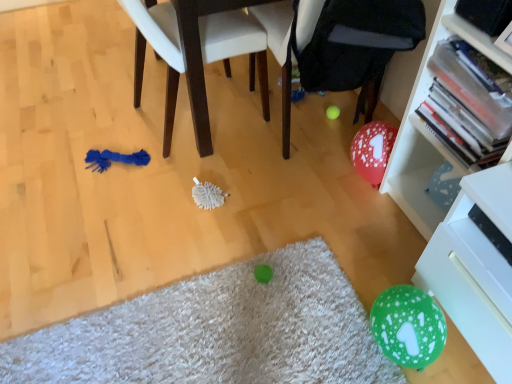
Where is `white glossy drawer at lower right`? This screenshot has height=384, width=512. white glossy drawer at lower right is located at coordinates (476, 267).

This screenshot has width=512, height=384. Find the location of `white plastic bookcase at right`. white plastic bookcase at right is located at coordinates (426, 134).

The height and width of the screenshot is (384, 512). Describe the element at coordinates (338, 44) in the screenshot. I see `black fabric bean bag chair at center` at that location.

What are the coordinates of `blue fabric chair at left` in the screenshot? It's located at (197, 52).

The image size is (512, 384). In order to click on white bristle brush at center in this screenshot , I will do `click(207, 195)`.

From the image's perspective, is blue fabric chair at left above white glossy drawer at lower right?

Yes, from the image's perspective, blue fabric chair at left is over white glossy drawer at lower right.

From a real-world perspective, does blue fabric chair at left sit lower than white glossy drawer at lower right?

No, from a real-world perspective, blue fabric chair at left is not below white glossy drawer at lower right.

Which is more to the right, blue fabric chair at left or white glossy drawer at lower right?

Positioned to the right is white glossy drawer at lower right.

Which is closer, [404,175] or [296,329]?

Point [296,329]

From a real-world perspective, who is located higher, white plastic bookcase at right or green fuzzy mat at lower center?

In real-world perspective, white plastic bookcase at right is above.

Are white plastic bookcase at right and green fuzzy mat at lower center beside each other?

No, white plastic bookcase at right is not beside green fuzzy mat at lower center.

Between white plastic bookcase at right and green fuzzy mat at lower center, which one has larger width?

green fuzzy mat at lower center.

Is black fabric bean bag chair at center not close to white glossy drawer at lower right?

black fabric bean bag chair at center is near white glossy drawer at lower right, not far away.

Can you confirm if black fabric bean bag chair at center is thinner than white glossy drawer at lower right?

Incorrect, the width of black fabric bean bag chair at center is not less than that of white glossy drawer at lower right.

Where is `shelf located in front of the black fabric bean bag chair at center`? The width and height of the screenshot is (512, 384). shelf located in front of the black fabric bean bag chair at center is located at coordinates (476, 267).

From a real-world perspective, is black fabric bean bag chair at center physically below white glossy drawer at lower right?

Actually, black fabric bean bag chair at center is physically above white glossy drawer at lower right in the real world.

Is white glossy drawer at lower right located outside green fuzzy mat at lower center?

Yes, white glossy drawer at lower right is outside of green fuzzy mat at lower center.

Which of these two, white glossy drawer at lower right or green fuzzy mat at lower center, stands shorter?

With less height is green fuzzy mat at lower center.

Considering the relative sizes of white glossy drawer at lower right and green fuzzy mat at lower center in the image provided, is white glossy drawer at lower right bigger than green fuzzy mat at lower center?

Yes, white glossy drawer at lower right is bigger than green fuzzy mat at lower center.

How far apart are white glossy drawer at lower right and blue fabric chair at left?

They are 3.57 feet apart.

Consider the image. Is blue fabric chair at left at the back of white glossy drawer at lower right?

No, blue fabric chair at left is not at the back of white glossy drawer at lower right.

Does white glossy drawer at lower right have a greater width compared to blue fabric chair at left?

Incorrect, the width of white glossy drawer at lower right does not surpass that of blue fabric chair at left.

From the image's perspective, which one is positioned higher, white glossy drawer at lower right or blue fabric chair at left?

blue fabric chair at left.

In the scene shown: Is green fuzzy mat at lower center taller than blue fabric chair at left?

No, green fuzzy mat at lower center is not taller than blue fabric chair at left.

Is green fuzzy mat at lower center in front of blue fabric chair at left?

Yes, green fuzzy mat at lower center is closer to the viewer.

Is green fuzzy mat at lower center in contact with blue fabric chair at left?

No, green fuzzy mat at lower center is not beside blue fabric chair at left.

Is green fuzzy mat at lower center spatially inside blue fabric chair at left, or outside of it?

green fuzzy mat at lower center is not enclosed by blue fabric chair at left.

This screenshot has width=512, height=384. I want to click on bookcase located in front of the white bristle brush at center, so click(x=426, y=134).

Who is shorter, white bristle brush at center or white plastic bookcase at right?

Standing shorter between the two is white bristle brush at center.

Consider the image. Is white bristle brush at center looking in the opposite direction of white plastic bookcase at right?

That's not correct — white bristle brush at center is not looking away from white plastic bookcase at right.

Based on the photo, can you tell me how much white bristle brush at center and white plastic bookcase at right differ in facing direction?

2.17 degrees.

Identify the location of shelf that appears in front of the blue fabric chair at left. (476, 267).

This screenshot has height=384, width=512. I want to click on mat lying below the white plastic bookcase at right (from the image's perspective), so click(217, 332).

Based on their spatial positions, is blue fabric chair at left or green fuzzy mat at lower center closer to white bristle brush at center?

Among the two, blue fabric chair at left is located nearer to white bristle brush at center.

Which object lies nearer to the anchor point blue fabric chair at left, green fuzzy mat at lower center or white bristle brush at center?

Based on the image, white bristle brush at center appears to be nearer to blue fabric chair at left.

Based on their spatial positions, is white plastic bookcase at right or black fabric bean bag chair at center closer to white bristle brush at center?

black fabric bean bag chair at center lies closer to white bristle brush at center than the other object.

Which object lies nearer to the anchor point green fuzzy mat at lower center, black fabric bean bag chair at center or white glossy drawer at lower right?

white glossy drawer at lower right is positioned closer to the anchor green fuzzy mat at lower center.

Considering their positions, is white bristle brush at center positioned further to white glossy drawer at lower right than blue fabric chair at left?

Based on the image, blue fabric chair at left appears to be further to white glossy drawer at lower right.

Which object lies further to the anchor point blue fabric chair at left, green fuzzy mat at lower center or black fabric bean bag chair at center?

Among the two, green fuzzy mat at lower center is located further to blue fabric chair at left.

Considering their positions, is blue fabric chair at left positioned closer to black fabric bean bag chair at center than white plastic bookcase at right?

Based on the image, blue fabric chair at left appears to be nearer to black fabric bean bag chair at center.

From the image, which object appears to be nearer to white plastic bookcase at right, blue fabric chair at left or green fuzzy mat at lower center?

green fuzzy mat at lower center lies closer to white plastic bookcase at right than the other object.

You are a GUI agent. You are given a task and a screenshot of the screen. Output one action in this format:
    pyautogui.click(x=<x>, y=<y>)
    Task: Click on the brush located between blue fabric chair at left and white glossy drawer at lower right in the left-right direction
    The image size is (512, 384).
    Given the screenshot: What is the action you would take?
    pyautogui.click(x=207, y=195)

The image size is (512, 384). In order to click on bean bag chair situated between white bristle brush at center and white plastic bookcase at right from left to right in this screenshot , I will do `click(338, 44)`.

Where is `bean bag chair between blue fabric chair at left and white bristle brush at center in the up-down direction`? bean bag chair between blue fabric chair at left and white bristle brush at center in the up-down direction is located at coordinates (338, 44).

Image resolution: width=512 pixels, height=384 pixels. What are the coordinates of `brush between black fabric bean bag chair at center and green fuzzy mat at lower center from top to bottom` in the screenshot? It's located at (207, 195).